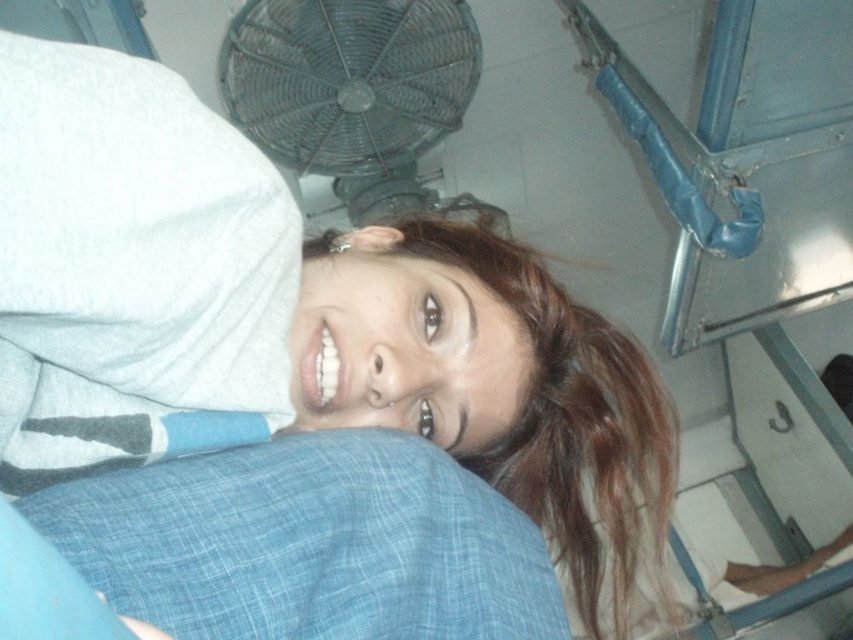
Question: Is smooth brown hair at center below metallic wire mesh fan at upper center?

Choices:
 (A) no
 (B) yes

Answer: (B)

Question: Does smooth brown hair at center appear under metallic wire mesh fan at upper center?

Choices:
 (A) no
 (B) yes

Answer: (B)

Question: Which point is farther to the camera?

Choices:
 (A) (247, 10)
 (B) (612, 477)

Answer: (A)

Question: Can you confirm if smooth brown hair at center is positioned to the left of metallic wire mesh fan at upper center?

Choices:
 (A) no
 (B) yes

Answer: (A)

Question: Which object appears farthest from the camera in this image?

Choices:
 (A) smooth brown hair at center
 (B) metallic wire mesh fan at upper center

Answer: (B)